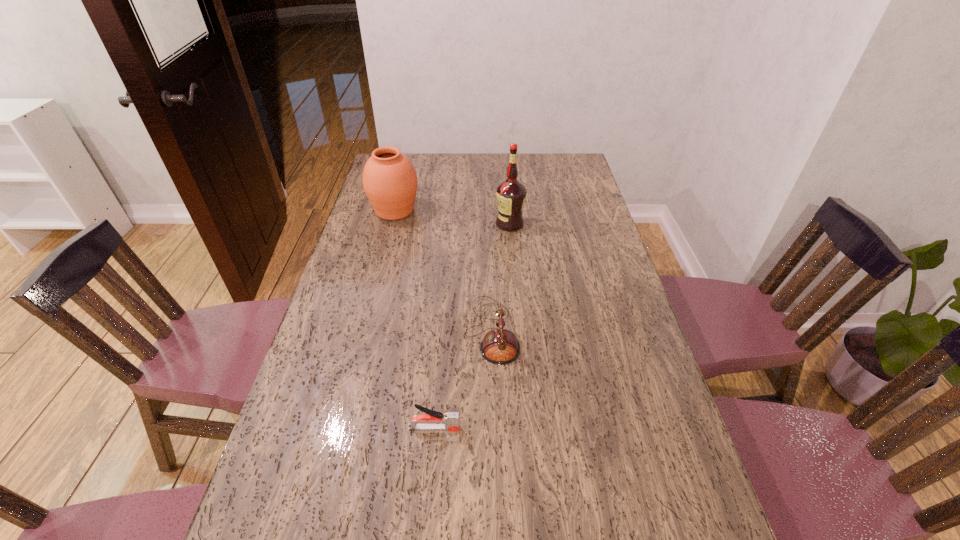
Image resolution: width=960 pixels, height=540 pixels. In order to click on free spot located on the rotary dial of the telephone in this screenshot , I will do [x=350, y=331].

Identify the location of free space located on the rotary dial of the telephone. This screenshot has width=960, height=540. (444, 331).

Locate an element on the screen. The width and height of the screenshot is (960, 540). blank space located on the rotary dial of the telephone is located at coordinates (387, 331).

The image size is (960, 540). I want to click on vacant space located on the handle side of the nearest object, so click(608, 428).

Locate an element on the screen. object at the left edge is located at coordinates (390, 182).

Find the location of a particular element. This screenshot has height=540, width=960. vacant point at the far edge is located at coordinates (470, 174).

The height and width of the screenshot is (540, 960). In order to click on free space at the left edge of the desktop in this screenshot , I will do `click(337, 351)`.

Identify the location of vacant space at the right edge of the desktop. This screenshot has height=540, width=960. (587, 206).

The height and width of the screenshot is (540, 960). I want to click on free region at the far right corner of the desktop, so click(561, 163).

You are a GUI agent. You are given a task and a screenshot of the screen. Output one action in this format:
    pyautogui.click(x=<x>, y=<y>)
    Task: Click on the free space between the tallest object and the third farthest object
    
    Given the screenshot: What is the action you would take?
    pyautogui.click(x=501, y=278)